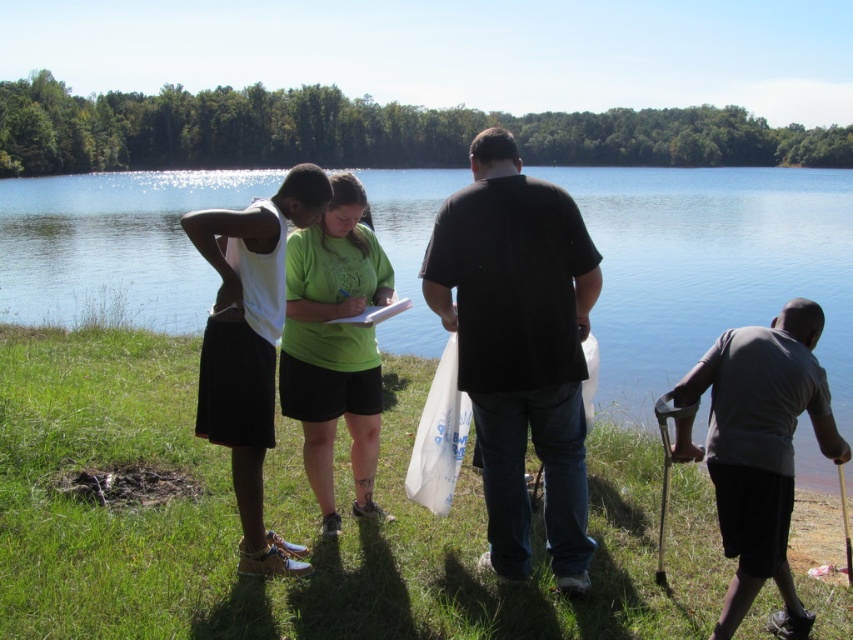
Question: Does transparent water at center have a lesser width compared to white matte tank top at left?

Choices:
 (A) yes
 (B) no

Answer: (B)

Question: Estimate the real-world distances between objects in this image. Which object is farther from the gray fabric shirt at lower right?

Choices:
 (A) green matte shirt at center
 (B) black matte shirt at center
 (C) white matte tank top at left
 (D) transparent water at center

Answer: (D)

Question: Is white matte tank top at left bigger than green matte shirt at center?

Choices:
 (A) no
 (B) yes

Answer: (B)

Question: Which of these objects is positioned closest to the transparent water at center?

Choices:
 (A) white matte tank top at left
 (B) black matte shirt at center
 (C) green matte shirt at center

Answer: (C)

Question: Which of the following is the farthest from the observer?

Choices:
 (A) (264, 563)
 (B) (457, 355)

Answer: (B)

Question: Is transparent water at center behind white matte tank top at left?

Choices:
 (A) no
 (B) yes

Answer: (B)